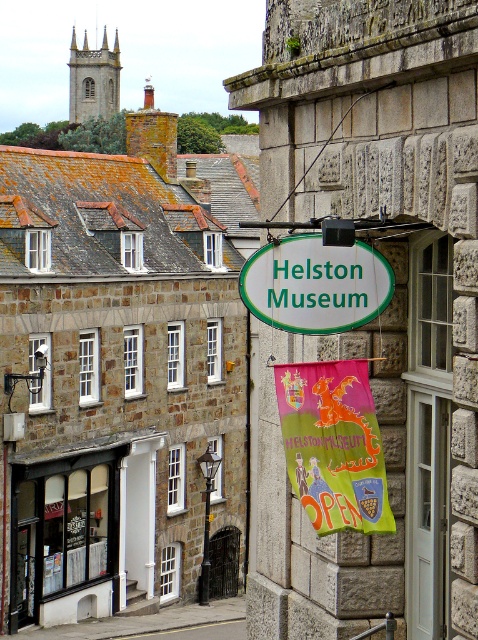
You are standing at a distance from the Helston Museum. The point marked at coordinates point (49, 524) is part of the building. Can you estimate how far you are from that point?

You are 48.46 meters away from the point (49, 524).

You are standing in front of the Helston Museum. You notice two points marked on the building. One is at coordinate point [120,508] and the other at point [292,328]. If you were to draw a straight line between them, which point would be closer to the entrance of the museum?

Point [292,328] is closer to the entrance of the museum because it is in front of point [120,508], which is behind it.

You are a visitor approaching the Helston Museum. You see the white glass storefront at lower left and the white oval sign at center. Which object is bigger in size?

The white glass storefront at lower left is larger in size compared to the white oval sign at center.